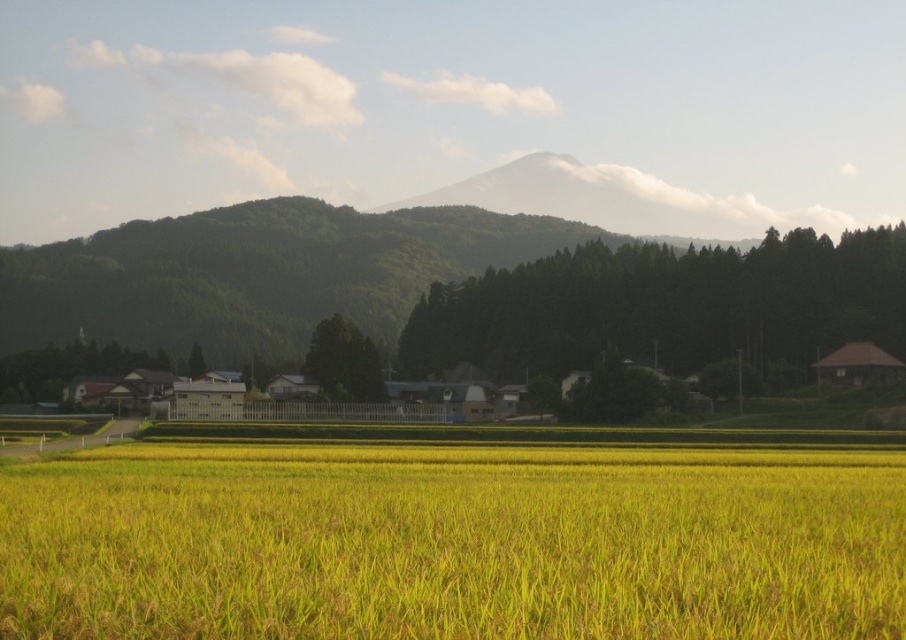
Question: Which point is farther to the camera?

Choices:
 (A) (856, 358)
 (B) (368, 497)

Answer: (A)

Question: Is yellow grass at center to the left of brown wooden hut at right from the viewer's perspective?

Choices:
 (A) no
 (B) yes

Answer: (B)

Question: Does yellow grass at center appear over brown wooden hut at right?

Choices:
 (A) no
 (B) yes

Answer: (B)

Question: Where is yellow grass at center located in relation to brown wooden hut at right in the image?

Choices:
 (A) above
 (B) below

Answer: (A)